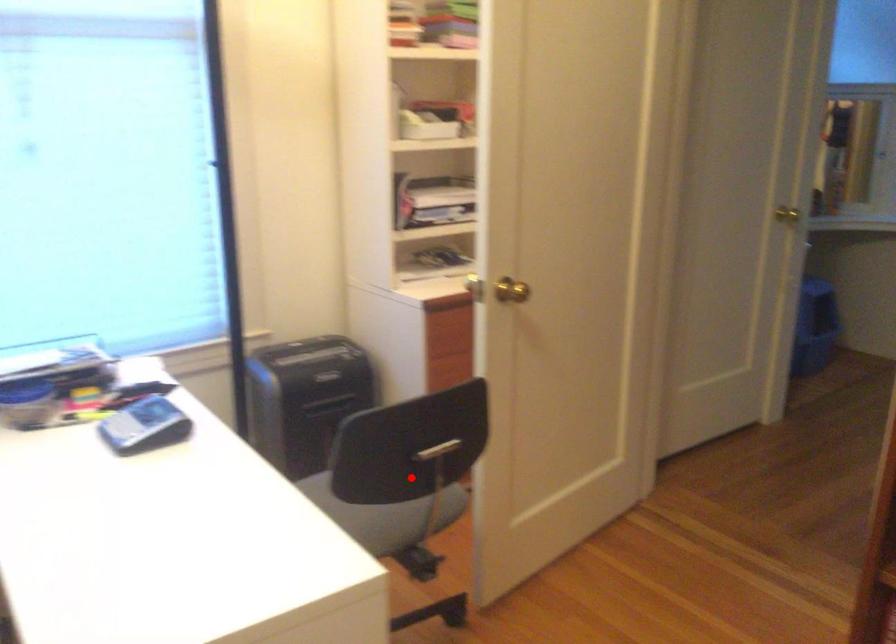
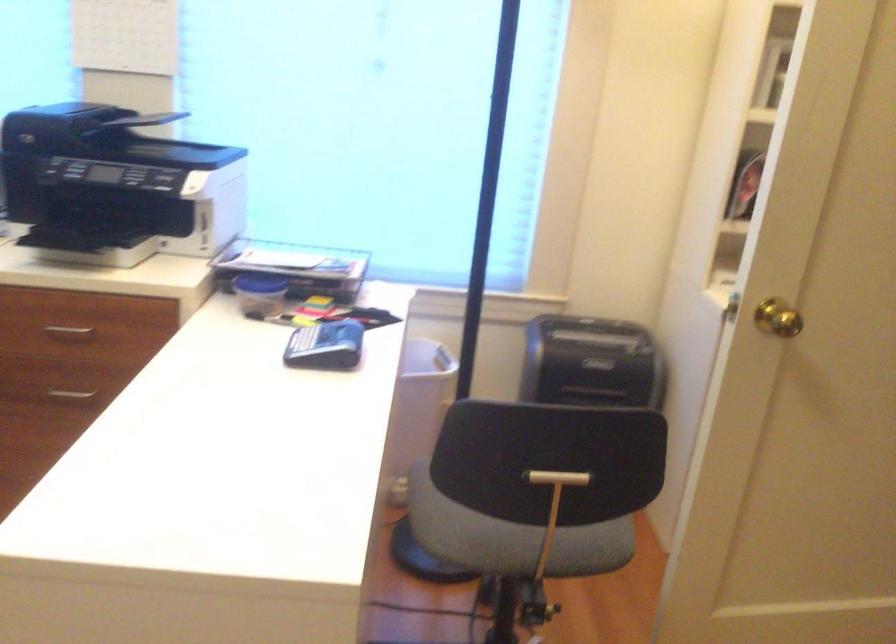
In the second image, find the point that corresponds to the highlighted location in the first image.

(535, 495)